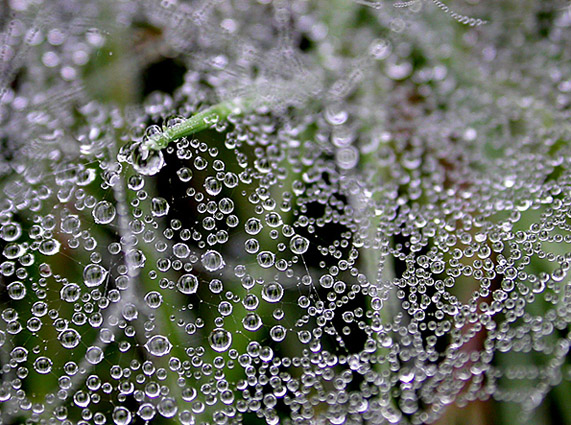
Where is `plant`? Image resolution: width=571 pixels, height=425 pixels. plant is located at coordinates (372, 261).